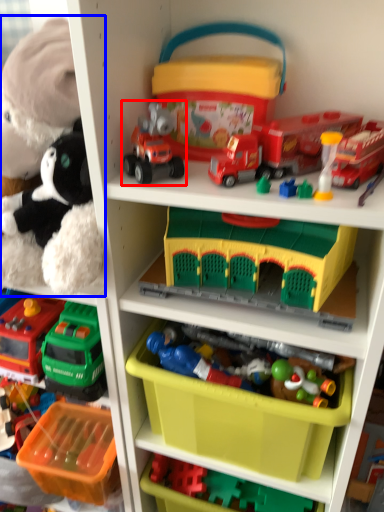
Question: Which point is closer to the camera, toy (highlighted by a red box) or toy (highlighted by a blue box)?

Choices:
 (A) toy
 (B) toy

Answer: (B)